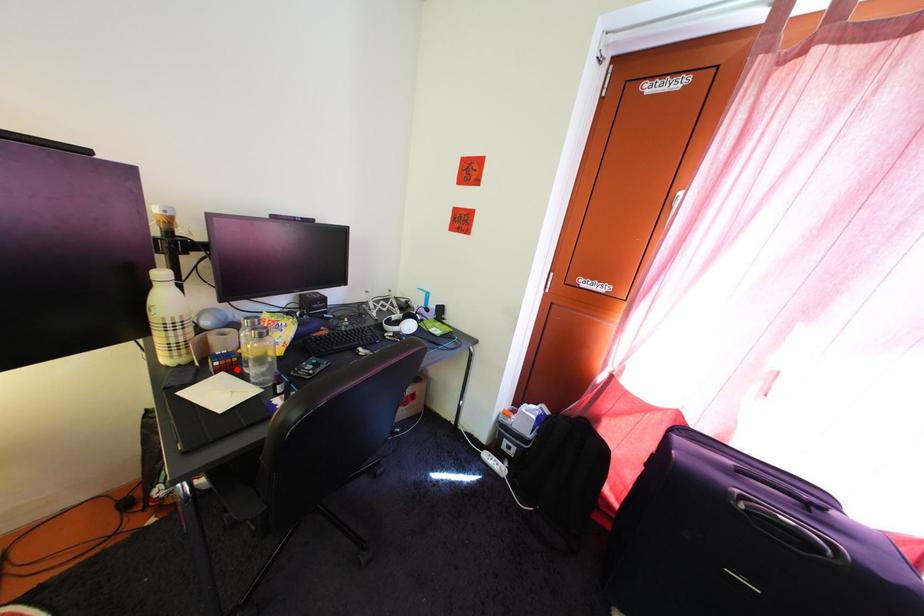
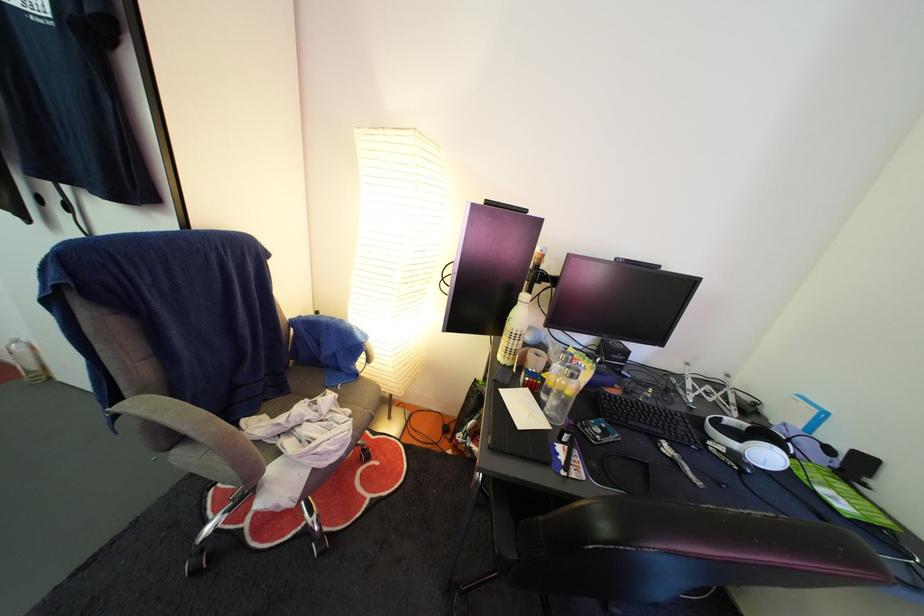
Question: I am providing you with two images of the same scene from different viewpoints. A red point is marked on the first image. At the location where the point appears in image 1, is it still visible in image 2?

Choices:
 (A) Yes
 (B) No

Answer: (A)